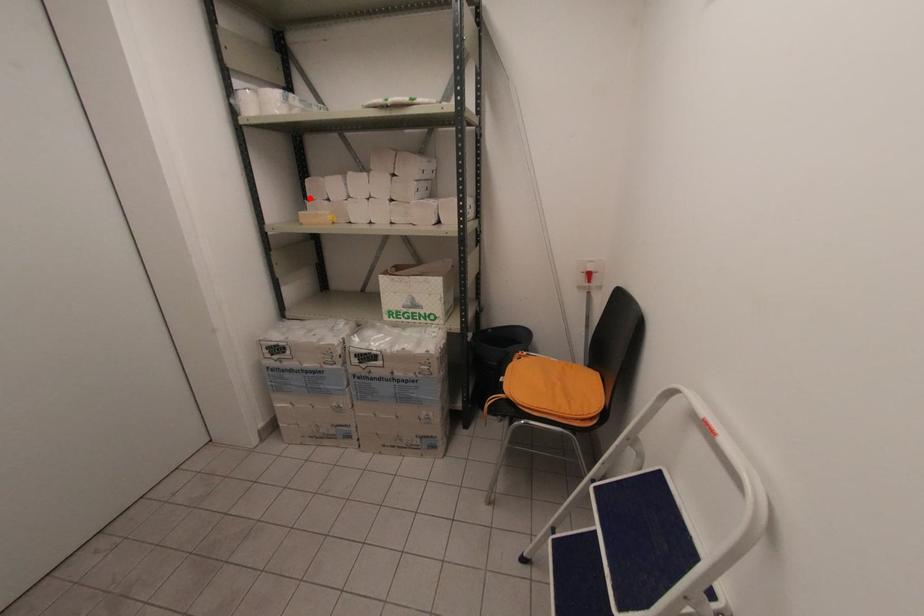
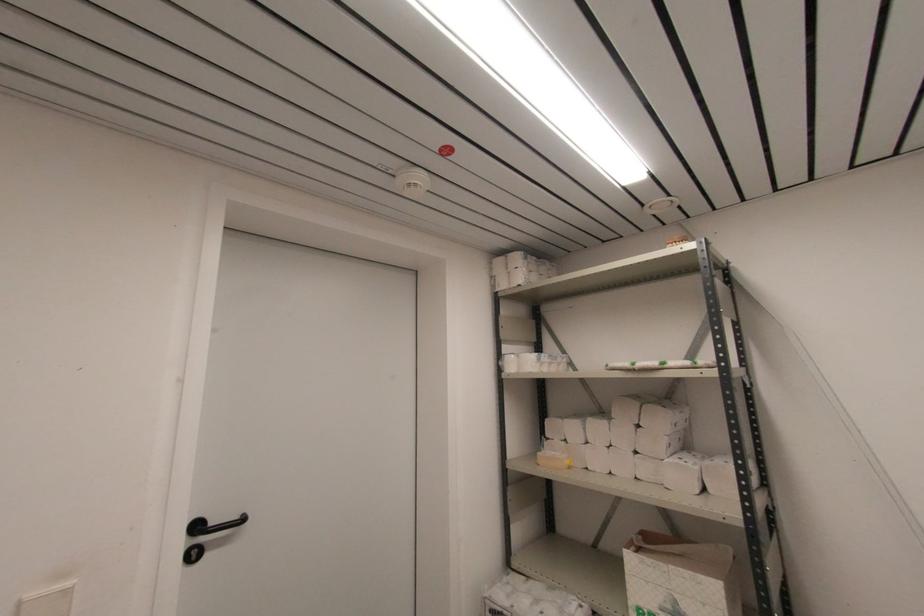
In the second image, find the point that corresponds to the highlighted location in the first image.

(548, 436)